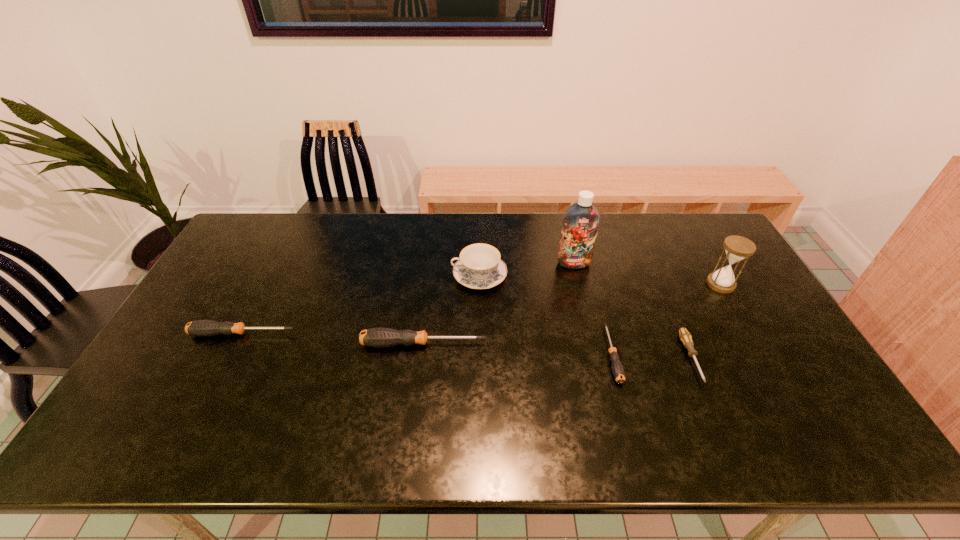
The image size is (960, 540). Identify the location of vacant space that satisfies the following two spatial constraints: 1. on the back side of the third shortest object; 2. on the left side of the hourglass. click(268, 284).